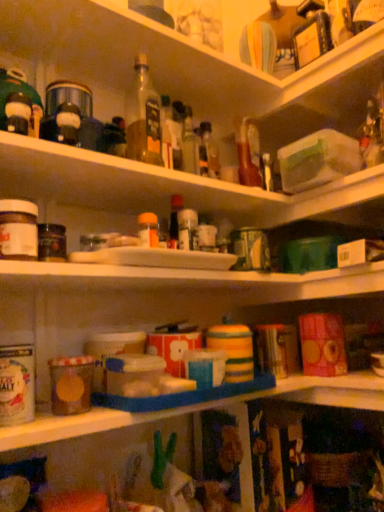
Where is `clear glass bottle at upper center`? This screenshot has width=384, height=512. clear glass bottle at upper center is located at coordinates (143, 117).

Measure the distance between clear glass bottle at upper center and camera.

34.37 inches.

The image size is (384, 512). What do you see at coordinates (143, 117) in the screenshot?
I see `clear glass bottle at upper center` at bounding box center [143, 117].

Find the location of a particular element. The image size is (384, 512). clear glass bottle at upper center is located at coordinates (143, 117).